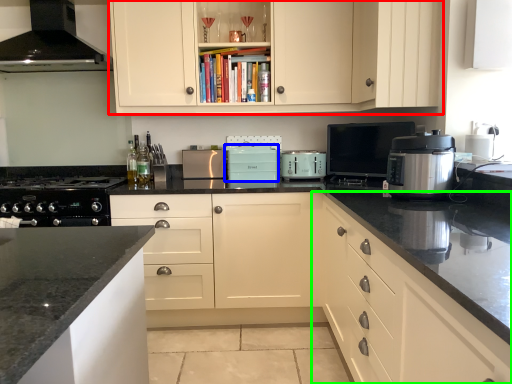
Question: Considering the real-world distances, which object is farthest from cabinetry (highlighted by a red box)? kitchen appliance (highlighted by a blue box) or cabinetry (highlighted by a green box)?

Choices:
 (A) kitchen appliance
 (B) cabinetry

Answer: (B)